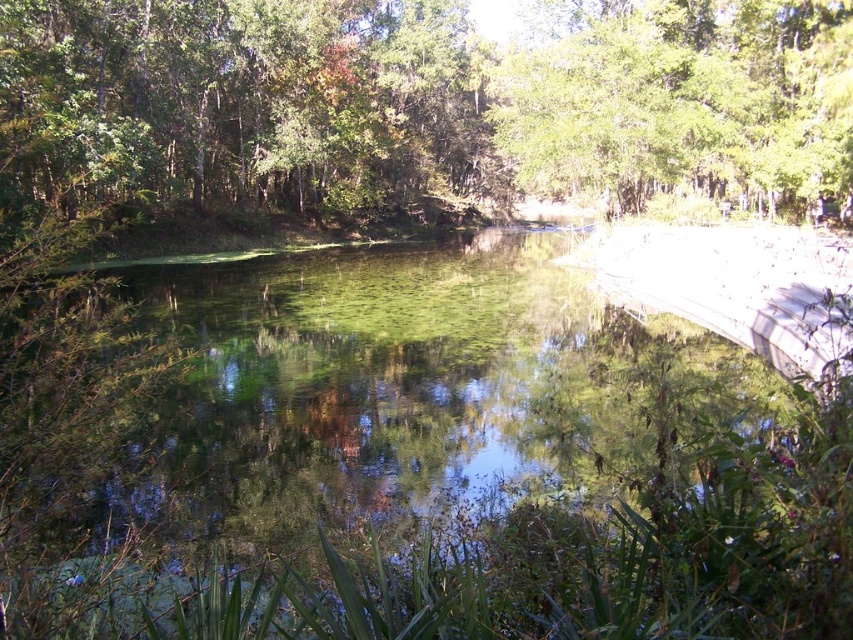
Question: Which point appears farthest from the camera in this image?

Choices:
 (A) (508, 125)
 (B) (723, 189)
 (C) (199, 481)

Answer: (B)

Question: Is green reflective water at center bigger than green leafy trees at upper center?

Choices:
 (A) no
 (B) yes

Answer: (A)

Question: Which point is farther to the camera?

Choices:
 (A) coord(257,429)
 (B) coord(526,132)
 (C) coord(831,72)

Answer: (B)

Question: Is green leafy trees at upper center positioned behind green leafy tree at upper center?

Choices:
 (A) no
 (B) yes

Answer: (A)

Question: Where is green reflective water at center located in relation to green leafy trees at upper center in the image?

Choices:
 (A) left
 (B) right

Answer: (A)

Question: Which point is closer to the camera?

Choices:
 (A) (161, 196)
 (B) (498, 333)

Answer: (B)